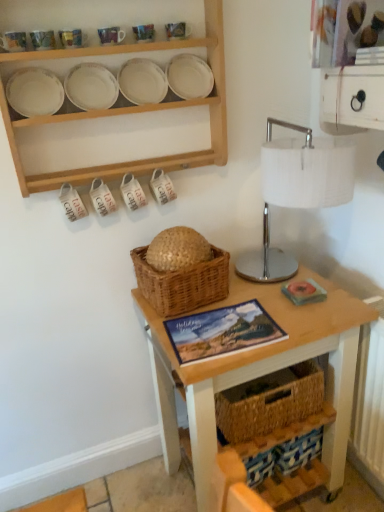
In order to click on vacant area on top of matte paper book at center (from a real-world perspective) in this screenshot , I will do `click(220, 327)`.